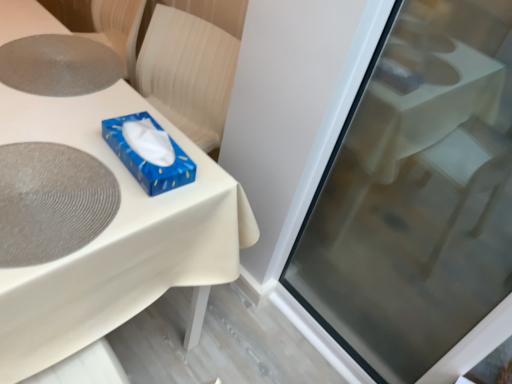
Identify the location of vacant space underneath matte gray placemat at upper left, the first oval in the bottom-to-top sequence (from a real-world perspective). This screenshot has height=384, width=512. (39, 173).